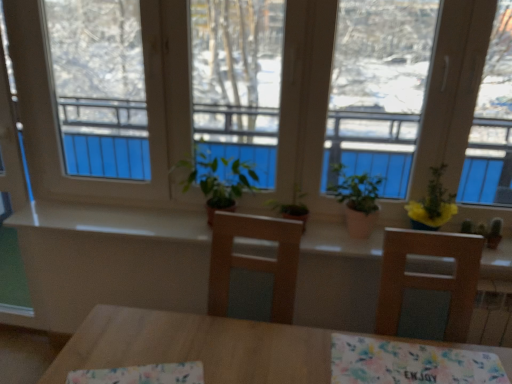
Question: Is green matte plant at center, the second houseplant viewed from the right, taller than floral fabric at center, which appears as the first tablecloth when viewed from the left?

Choices:
 (A) yes
 (B) no

Answer: (A)

Question: Considering the relative sizes of green matte plant at center, the second houseplant viewed from the right, and floral fabric at center, the second tablecloth from the right, in the image provided, is green matte plant at center, the second houseplant viewed from the right, shorter than floral fabric at center, the second tablecloth from the right,?

Choices:
 (A) yes
 (B) no

Answer: (B)

Question: Can you confirm if green matte plant at center, the second houseplant viewed from the right, is positioned to the right of floral fabric at center, which appears as the first tablecloth when viewed from the left?

Choices:
 (A) no
 (B) yes

Answer: (B)

Question: Does green matte plant at center, the 2th houseplant from the left, have a lesser width compared to floral fabric at center, which appears as the first tablecloth when viewed from the left?

Choices:
 (A) no
 (B) yes

Answer: (B)

Question: Is green matte plant at center, the second houseplant viewed from the right, in contact with floral fabric at center, the second tablecloth from the right?

Choices:
 (A) yes
 (B) no

Answer: (B)

Question: Considering their positions, is floral fabric at center, which appears as the first tablecloth when viewed from the left, located in front of or behind green matte plant at center, the 2th houseplant from the left?

Choices:
 (A) front
 (B) behind

Answer: (A)

Question: From the image's perspective, is floral fabric at center, which appears as the first tablecloth when viewed from the left, located above or below green matte plant at center, the second houseplant viewed from the right?

Choices:
 (A) below
 (B) above

Answer: (A)

Question: Based on their positions, is floral fabric at center, the second tablecloth from the right, located to the left or right of green matte plant at center, the 2th houseplant from the left?

Choices:
 (A) right
 (B) left

Answer: (B)

Question: In terms of size, does floral fabric at center, the second tablecloth from the right, appear bigger or smaller than green matte plant at center, the 2th houseplant from the left?

Choices:
 (A) small
 (B) big

Answer: (A)

Question: Looking at their shapes, would you say transparent glass window at center is wider or thinner than green matte plant at center, marked as the first houseplant in a left-to-right arrangement?

Choices:
 (A) wide
 (B) thin

Answer: (B)

Question: Is point (181, 198) positioned closer to the camera than point (282, 205)?

Choices:
 (A) farther
 (B) closer

Answer: (A)

Question: Considering their positions, is transparent glass window at center located in front of or behind green matte plant at center, the third houseplant viewed from the right?

Choices:
 (A) front
 (B) behind

Answer: (A)

Question: From the image's perspective, is transparent glass window at center located above or below green matte plant at center, the third houseplant viewed from the right?

Choices:
 (A) above
 (B) below

Answer: (A)

Question: Is white glossy counter top at center bigger or smaller than yellow matte plant at upper right, which is the third houseplant in left-to-right order?

Choices:
 (A) small
 (B) big

Answer: (B)

Question: From a real-world perspective, is white glossy counter top at center positioned above or below yellow matte plant at upper right, acting as the 1th houseplant starting from the right?

Choices:
 (A) below
 (B) above

Answer: (A)